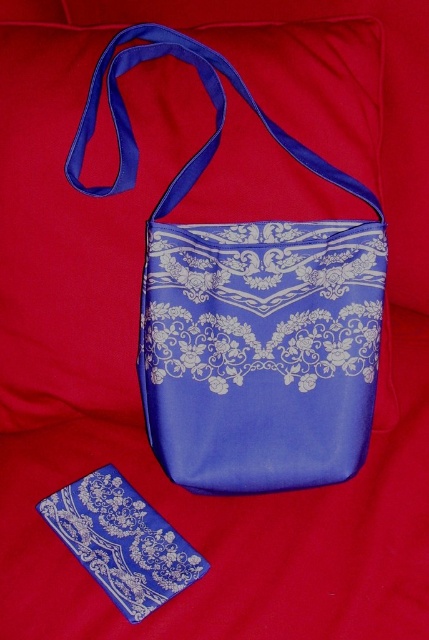
Question: Can you confirm if blue satin wallet at center is positioned below blue satin strap at upper center?

Choices:
 (A) no
 (B) yes

Answer: (B)

Question: From the image, what is the correct spatial relationship of blue satin wallet at center in relation to blue satin strap at upper center?

Choices:
 (A) left
 (B) right

Answer: (A)

Question: Among these objects, which one is nearest to the camera?

Choices:
 (A) blue satin wallet at center
 (B) blue satin/velvet shoulder bag at center

Answer: (A)

Question: Which point is closer to the camera taking this photo?

Choices:
 (A) (90, 118)
 (B) (375, 348)
 (C) (68, 506)

Answer: (A)

Question: Which point appears closest to the camera in this image?

Choices:
 (A) (90, 572)
 (B) (172, 330)
 (C) (375, 205)

Answer: (A)

Question: Is blue satin/velvet shoulder bag at center positioned in front of blue satin strap at upper center?

Choices:
 (A) no
 (B) yes

Answer: (A)